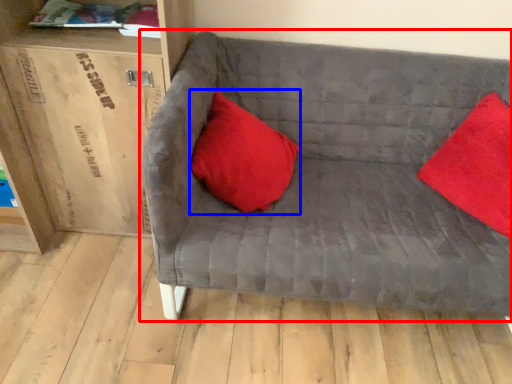
Question: Among these objects, which one is farthest to the camera, studio couch (highlighted by a red box) or pillow (highlighted by a blue box)?

Choices:
 (A) studio couch
 (B) pillow

Answer: (B)